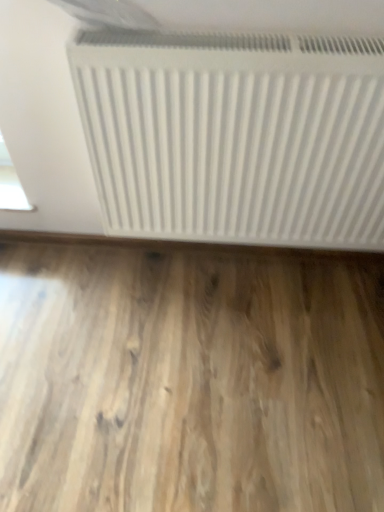
The image size is (384, 512). Find the location of `vacant space situated above light brown wood flooring at bottom (from a real-world perspective)`. vacant space situated above light brown wood flooring at bottom (from a real-world perspective) is located at coordinates (175, 364).